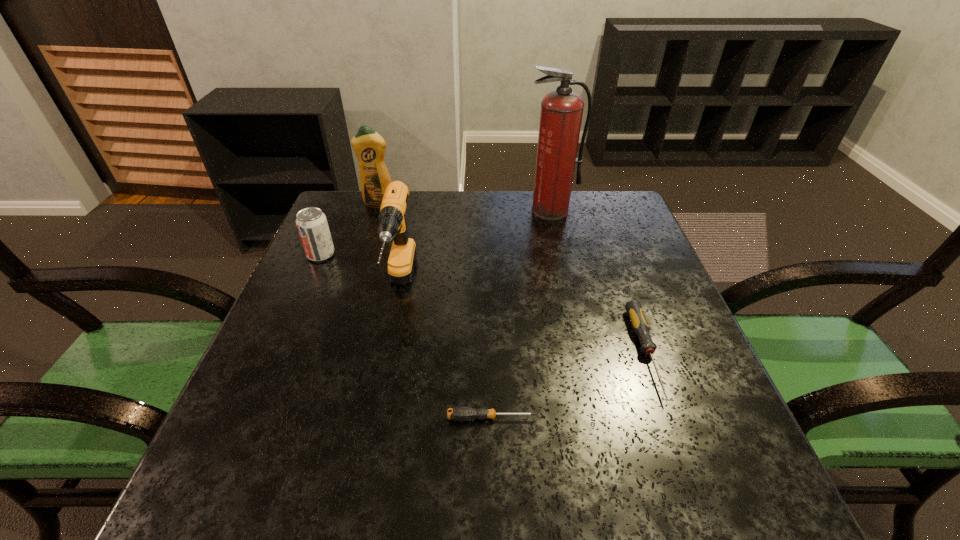
Find the location of `vacant space in between the fifth object from right to left and the tallest object`. vacant space in between the fifth object from right to left and the tallest object is located at coordinates (465, 207).

Where is `empty space that is in between the fourth object from left to right and the fire extinguisher`? This screenshot has height=540, width=960. empty space that is in between the fourth object from left to right and the fire extinguisher is located at coordinates (521, 314).

Locate an element on the screen. The height and width of the screenshot is (540, 960). free spot between the nearest object and the soda can is located at coordinates (406, 336).

At what (x,y) coordinates should I click in order to perform the action: click on empty space that is in between the rightmost object and the third shortest object. Please return your answer as a coordinate pair (x, y). This screenshot has height=540, width=960. Looking at the image, I should click on (484, 303).

Where is `free spot between the fifth object from right to left and the taller screwdriver`? Image resolution: width=960 pixels, height=540 pixels. free spot between the fifth object from right to left and the taller screwdriver is located at coordinates (513, 279).

The height and width of the screenshot is (540, 960). Identify the location of free spot between the nearest object and the drill. (445, 353).

At what (x,y) coordinates should I click in order to perform the action: click on free spot between the right screwdriver and the nearer screwdriver. Please return your answer as a coordinate pair (x, y). Looking at the image, I should click on (569, 385).

Locate which object ranks fourth in proximity to the fire extinguisher. Please provide its 2D coordinates. Your answer should be formatted as a tuple, i.e. [(x, y)], where the tuple contains the x and y coordinates of a point satisfying the conditions above.

[(312, 225)]

Locate which object is the third closest to the detergent. Please provide its 2D coordinates. Your answer should be formatted as a tuple, i.e. [(x, y)], where the tuple contains the x and y coordinates of a point satisfying the conditions above.

[(561, 113)]

Find the location of a particular element. This screenshot has width=960, height=540. vacant space that satisfies the following two spatial constraints: 1. on the label of the fifth object from right to left; 2. on the left side of the shortest object is located at coordinates (310, 418).